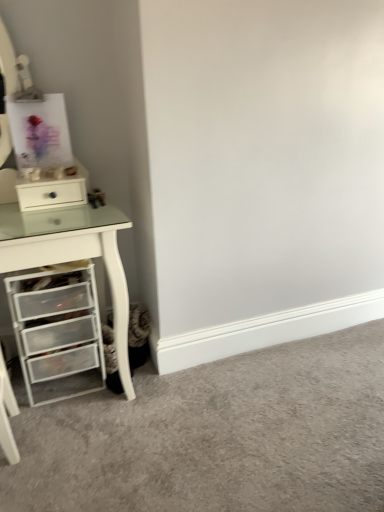
Question: From the image's perspective, is white plastic drawers at lower left located above white plastic drawer unit at left?

Choices:
 (A) no
 (B) yes

Answer: (A)

Question: Does white plastic drawers at lower left have a lesser height compared to white plastic drawer unit at left?

Choices:
 (A) yes
 (B) no

Answer: (A)

Question: Is white plastic drawers at lower left wider than white plastic drawer unit at left?

Choices:
 (A) yes
 (B) no

Answer: (B)

Question: Are white plastic drawers at lower left and white plastic drawer unit at left far apart?

Choices:
 (A) no
 (B) yes

Answer: (A)

Question: Is white plastic drawers at lower left next to white plastic drawer unit at left and touching it?

Choices:
 (A) no
 (B) yes

Answer: (A)

Question: Considering the positions of white plastic drawer unit at left and white glossy drawer at upper left in the image, is white plastic drawer unit at left taller or shorter than white glossy drawer at upper left?

Choices:
 (A) short
 (B) tall

Answer: (B)

Question: From a real-world perspective, relative to white glossy drawer at upper left, is white plastic drawer unit at left vertically above or below?

Choices:
 (A) above
 (B) below

Answer: (B)

Question: In terms of width, does white plastic drawer unit at left look wider or thinner when compared to white glossy drawer at upper left?

Choices:
 (A) thin
 (B) wide

Answer: (B)

Question: From the image's perspective, is white plastic drawer unit at left located above or below white glossy drawer at upper left?

Choices:
 (A) below
 (B) above

Answer: (A)

Question: Relative to white plastic drawers at lower left, is white plastic drawer unit at left in front or behind?

Choices:
 (A) front
 (B) behind

Answer: (A)

Question: From the image's perspective, is white plastic drawer unit at left above or below white plastic drawers at lower left?

Choices:
 (A) above
 (B) below

Answer: (A)

Question: From their relative heights in the image, would you say white plastic drawer unit at left is taller or shorter than white plastic drawers at lower left?

Choices:
 (A) tall
 (B) short

Answer: (A)

Question: Would you say white plastic drawer unit at left is to the left or to the right of white plastic drawers at lower left in the picture?

Choices:
 (A) left
 (B) right

Answer: (B)

Question: Is white plastic drawers at lower left bigger or smaller than white plastic drawer unit at left?

Choices:
 (A) big
 (B) small

Answer: (B)

Question: Considering the positions of point (54, 320) and point (94, 256), is point (54, 320) closer or farther from the camera than point (94, 256)?

Choices:
 (A) closer
 (B) farther

Answer: (B)